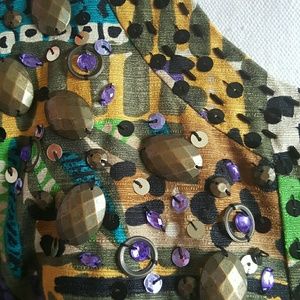
The image size is (300, 300). I want to click on decoration, so click(80, 214), click(174, 168), click(221, 274).